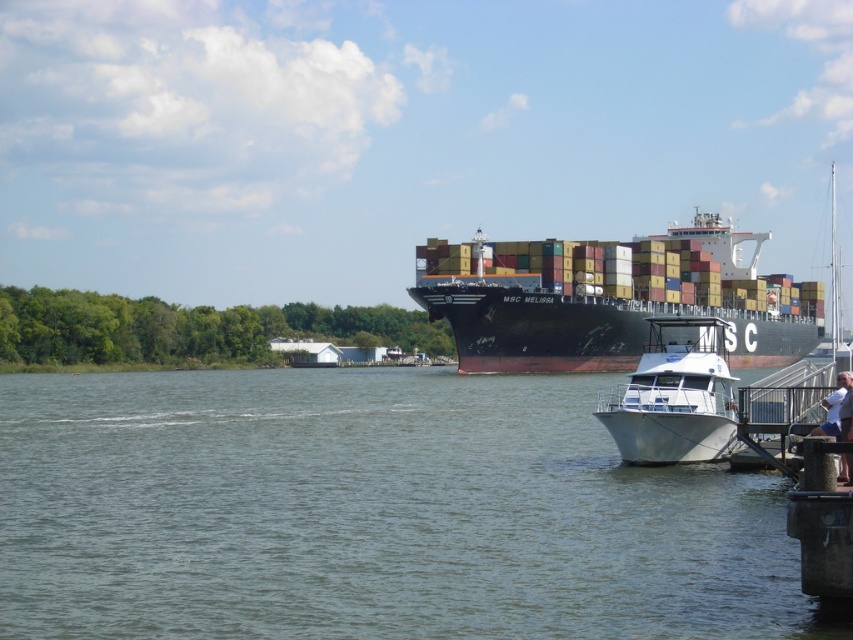
Question: Is the position of greenish water at lower left more distant than that of white glossy boat at lower right?

Choices:
 (A) no
 (B) yes

Answer: (A)

Question: Which point is closer to the camera?

Choices:
 (A) greenish water at lower left
 (B) black matte container ship at center

Answer: (A)

Question: Which is farther from the greenish water at lower left?

Choices:
 (A) black matte container ship at center
 (B) white glossy boat at lower right

Answer: (A)

Question: From the image, what is the correct spatial relationship of greenish water at lower left in relation to black matte container ship at center?

Choices:
 (A) above
 (B) below

Answer: (B)

Question: Estimate the real-world distances between objects in this image. Which object is farther from the white glossy boat at lower right?

Choices:
 (A) greenish water at lower left
 (B) black matte container ship at center

Answer: (B)

Question: Is the position of greenish water at lower left less distant than that of black matte container ship at center?

Choices:
 (A) no
 (B) yes

Answer: (B)